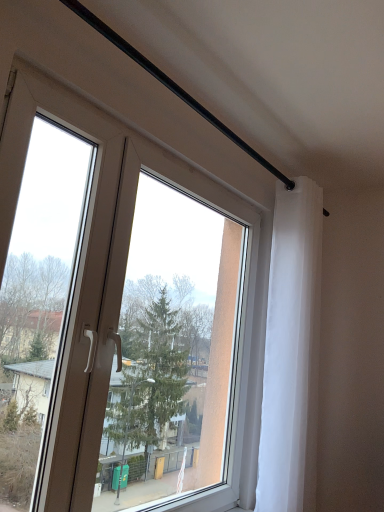
Question: In the image, is transparent glass window at center on the left side or the right side of white sheer curtain at upper right?

Choices:
 (A) right
 (B) left

Answer: (B)

Question: Does point (221, 207) appear closer or farther from the camera than point (307, 458)?

Choices:
 (A) closer
 (B) farther

Answer: (A)

Question: Do you think transparent glass window at center is within white sheer curtain at upper right, or outside of it?

Choices:
 (A) inside
 (B) outside

Answer: (B)

Question: Considering the positions of point (294, 489) and point (269, 224), is point (294, 489) closer or farther from the camera than point (269, 224)?

Choices:
 (A) closer
 (B) farther

Answer: (A)

Question: From their relative heights in the image, would you say white sheer curtain at upper right is taller or shorter than transparent glass window at center?

Choices:
 (A) short
 (B) tall

Answer: (B)

Question: Considering the positions of white sheer curtain at upper right and transparent glass window at center in the image, is white sheer curtain at upper right bigger or smaller than transparent glass window at center?

Choices:
 (A) big
 (B) small

Answer: (B)

Question: Is white sheer curtain at upper right wider or thinner than transparent glass window at center?

Choices:
 (A) thin
 (B) wide

Answer: (B)